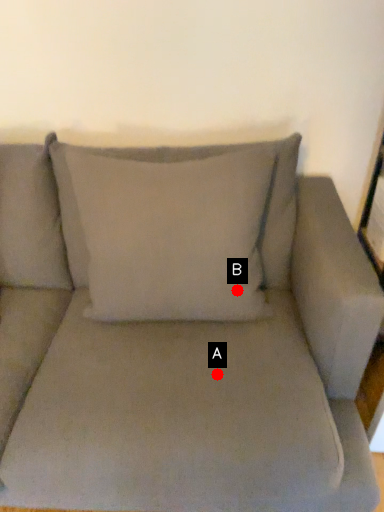
Question: Two points are circled on the image, labeled by A and B beside each circle. Which point is farther from the camera taking this photo?

Choices:
 (A) A is further
 (B) B is further

Answer: (B)